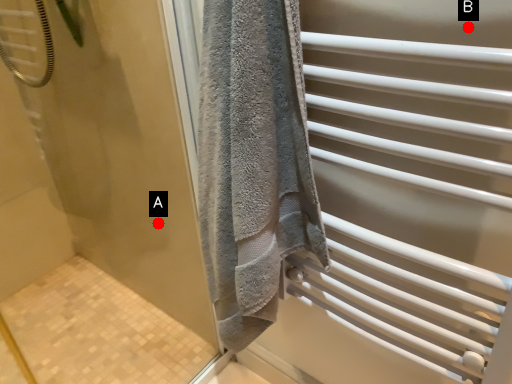
Question: Two points are circled on the image, labeled by A and B beside each circle. Which point is farther to the camera?

Choices:
 (A) A is further
 (B) B is further

Answer: (A)